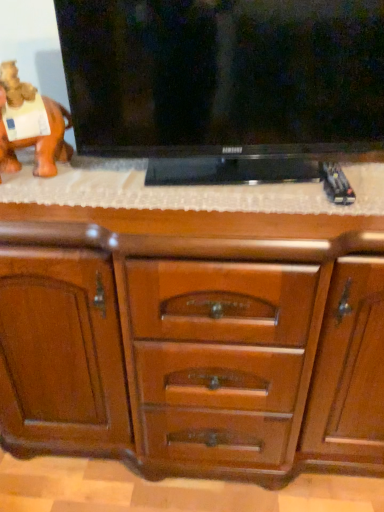
I want to click on free space in front of orange matte elephant at left, so click(41, 197).